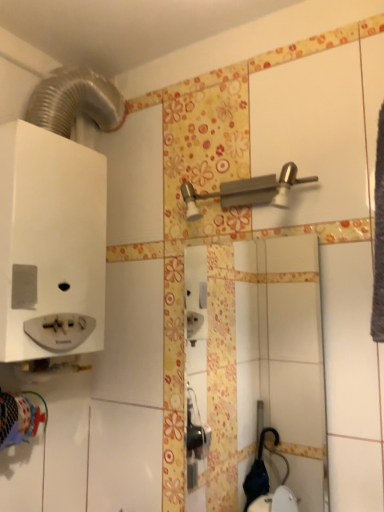
Question: Does white glossy mirror at center come in front of satin nickel shower at upper center?

Choices:
 (A) no
 (B) yes

Answer: (A)

Question: Is white glossy mirror at center looking in the opposite direction of satin nickel shower at upper center?

Choices:
 (A) no
 (B) yes

Answer: (A)

Question: Is white glossy mirror at center not inside satin nickel shower at upper center?

Choices:
 (A) yes
 (B) no

Answer: (A)

Question: Can satin nickel shower at upper center be found inside white glossy mirror at center?

Choices:
 (A) yes
 (B) no

Answer: (B)

Question: From a real-world perspective, is white glossy mirror at center positioned over satin nickel shower at upper center based on gravity?

Choices:
 (A) no
 (B) yes

Answer: (A)

Question: Are white glossy mirror at center and satin nickel shower at upper center located far from each other?

Choices:
 (A) no
 (B) yes

Answer: (B)

Question: Is satin nickel shower at upper center further to camera compared to white glossy mirror at center?

Choices:
 (A) yes
 (B) no

Answer: (B)

Question: Does satin nickel shower at upper center come in front of white glossy mirror at center?

Choices:
 (A) yes
 (B) no

Answer: (A)

Question: Is satin nickel shower at upper center completely or partially outside of white glossy mirror at center?

Choices:
 (A) no
 (B) yes

Answer: (B)

Question: Does satin nickel shower at upper center have a greater width compared to white glossy mirror at center?

Choices:
 (A) no
 (B) yes

Answer: (B)

Question: Does satin nickel shower at upper center have a lesser height compared to white glossy mirror at center?

Choices:
 (A) yes
 (B) no

Answer: (A)

Question: Is satin nickel shower at upper center touching white glossy mirror at center?

Choices:
 (A) yes
 (B) no

Answer: (B)

Question: From a real-world perspective, is white glossy mirror at center positioned above or below satin nickel shower at upper center?

Choices:
 (A) below
 (B) above

Answer: (A)